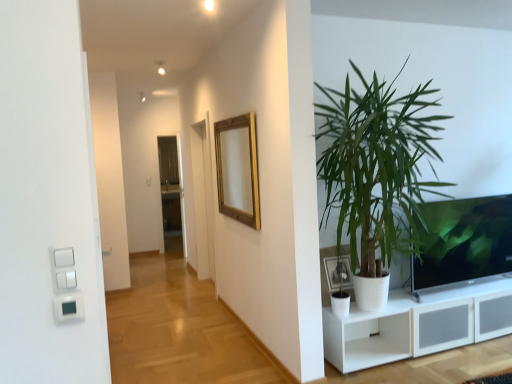
I want to click on matte black tv at right, so point(463,241).

The height and width of the screenshot is (384, 512). Describe the element at coordinates (172, 187) in the screenshot. I see `transparent glass door at center` at that location.

Find the location of a particular element. This screenshot has width=512, height=384. green leafy plant at right is located at coordinates (377, 166).

Identify the location of matte black tv at right. This screenshot has width=512, height=384. (463, 241).

Considering the sizes of objects gold wooden mirror at upper center and transparent glass door at center in the image provided, who is thinner, gold wooden mirror at upper center or transparent glass door at center?

transparent glass door at center is thinner.

I want to click on mirror above the transparent glass door at center (from a real-world perspective), so [x=238, y=169].

Does gold wooden mirror at upper center turn towards transparent glass door at center?

No, gold wooden mirror at upper center is not oriented towards transparent glass door at center.

Would you say gold wooden mirror at upper center is outside transparent glass door at center?

Yes.

Is point (356, 174) positioned before point (336, 288)?

Yes, it is in front of point (336, 288).

Looking at this image, considering the relative sizes of green leafy plant at right and matte black picture frame at lower right in the image provided, is green leafy plant at right shorter than matte black picture frame at lower right?

Incorrect, the height of green leafy plant at right does not fall short of that of matte black picture frame at lower right.

Choose the correct answer: Is green leafy plant at right inside matte black picture frame at lower right or outside it?

green leafy plant at right lies outside matte black picture frame at lower right.

Between green leafy plant at right and matte black picture frame at lower right, which one has smaller width?

matte black picture frame at lower right is thinner.

Considering the points (366, 139) and (453, 205), which point is behind, point (366, 139) or point (453, 205)?

The point (453, 205) is behind.

In the scene shown: From the image's perspective, is green leafy plant at right above matte black tv at right?

Yes, from the image's perspective, green leafy plant at right is over matte black tv at right.

Relative to matte black tv at right, is green leafy plant at right in front or behind?

Visually, green leafy plant at right is located in front of matte black tv at right.

How much distance is there between white plastic light switch at lower left and matte black picture frame at lower right?

white plastic light switch at lower left and matte black picture frame at lower right are 2.04 meters apart from each other.

From a real-world perspective, is white plastic light switch at lower left below matte black picture frame at lower right?

Actually, white plastic light switch at lower left is physically above matte black picture frame at lower right in the real world.

Is matte black picture frame at lower right at the back of white plastic light switch at lower left?

That's not correct — white plastic light switch at lower left is not looking away from matte black picture frame at lower right.

Is white plastic light switch at lower left not inside matte black picture frame at lower right?

Indeed, white plastic light switch at lower left is completely outside matte black picture frame at lower right.

Does matte black picture frame at lower right lie behind white plastic light switch at lower left?

Yes, matte black picture frame at lower right is further from the camera.

Is there a large distance between matte black picture frame at lower right and white plastic light switch at lower left?

Yes, matte black picture frame at lower right and white plastic light switch at lower left are quite far apart.

From a real-world perspective, which is physically below, matte black picture frame at lower right or white plastic light switch at lower left?

matte black picture frame at lower right.

Could you tell me if matte black picture frame at lower right is facing white plastic light switch at lower left?

No.

Which object is thinner, white plastic light switch at lower left or gold wooden mirror at upper center?

With smaller width is white plastic light switch at lower left.

In terms of height, does white plastic light switch at lower left look taller or shorter compared to gold wooden mirror at upper center?

white plastic light switch at lower left is shorter than gold wooden mirror at upper center.

From the image's perspective, which is below, white plastic light switch at lower left or gold wooden mirror at upper center?

white plastic light switch at lower left.

Which point is more distant from viewer, (62, 321) or (255, 135)?

Positioned behind is point (255, 135).

Is gold wooden mirror at upper center bigger than matte black tv at right?

No.

From the image's perspective, is gold wooden mirror at upper center beneath matte black tv at right?

No, from the image's perspective, gold wooden mirror at upper center is not below matte black tv at right.

Which of these two, gold wooden mirror at upper center or matte black tv at right, is thinner?

Thinner between the two is gold wooden mirror at upper center.

Does gold wooden mirror at upper center appear on the right side of matte black tv at right?

No, gold wooden mirror at upper center is not to the right of matte black tv at right.

Locate an element on the screen. mirror above the transparent glass door at center (from the image's perspective) is located at coordinates (238, 169).

I want to click on houseplant on the right of matte black picture frame at lower right, so click(x=377, y=166).

Looking at the image, which one is located closer to matte black tv at right, gold wooden mirror at upper center or transparent glass door at center?

Based on the image, gold wooden mirror at upper center appears to be nearer to matte black tv at right.

Based on their spatial positions, is green leafy plant at right or transparent glass door at center closer to matte black tv at right?

green leafy plant at right is closer to matte black tv at right.

In the scene shown: Considering their positions, is white plastic light switch at lower left positioned closer to gold wooden mirror at upper center than matte black picture frame at lower right?

matte black picture frame at lower right.

From the image, which object appears to be farther from green leafy plant at right, matte black tv at right or transparent glass door at center?

transparent glass door at center is further to green leafy plant at right.

Considering their positions, is white plastic light switch at lower left positioned further to gold wooden mirror at upper center than green leafy plant at right?

Based on the image, white plastic light switch at lower left appears to be further to gold wooden mirror at upper center.

Considering their positions, is green leafy plant at right positioned closer to matte black picture frame at lower right than white plastic light switch at lower left?

green leafy plant at right is positioned closer to the anchor matte black picture frame at lower right.

From the image, which object appears to be farther from matte black tv at right, matte black picture frame at lower right or white plastic light switch at lower left?

white plastic light switch at lower left lies further to matte black tv at right than the other object.

From the image, which object appears to be nearer to transparent glass door at center, green leafy plant at right or matte black tv at right?

Based on the image, green leafy plant at right appears to be nearer to transparent glass door at center.

You are a GUI agent. You are given a task and a screenshot of the screen. Output one action in this format:
    pyautogui.click(x=<x>, y=<y>)
    Task: Click on the mirror between green leafy plant at right and transparent glass door at center from front to back
    
    Given the screenshot: What is the action you would take?
    pyautogui.click(x=238, y=169)

You are a GUI agent. You are given a task and a screenshot of the screen. Output one action in this format:
    pyautogui.click(x=<x>, y=<y>)
    Task: Click on the mirror positioned between matte black picture frame at lower right and transparent glass door at center from near to far
    
    Given the screenshot: What is the action you would take?
    pyautogui.click(x=238, y=169)

You are a GUI agent. You are given a task and a screenshot of the screen. Output one action in this format:
    pyautogui.click(x=<x>, y=<y>)
    Task: Click on the houseplant located between white plastic light switch at lower left and transparent glass door at center in the depth direction
    The width and height of the screenshot is (512, 384).
    Given the screenshot: What is the action you would take?
    pyautogui.click(x=377, y=166)

You are a GUI agent. You are given a task and a screenshot of the screen. Output one action in this format:
    pyautogui.click(x=<x>, y=<y>)
    Task: Click on the picture frame between white plastic light switch at lower left and transparent glass door at center along the z-axis
    Image resolution: width=512 pixels, height=384 pixels.
    Given the screenshot: What is the action you would take?
    pyautogui.click(x=338, y=273)